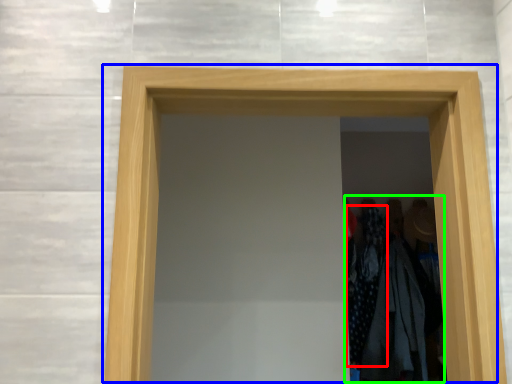
Question: Which is nearer to the clothing (highlighted by a red box)? door (highlighted by a blue box) or laundry (highlighted by a green box).

Choices:
 (A) door
 (B) laundry

Answer: (B)